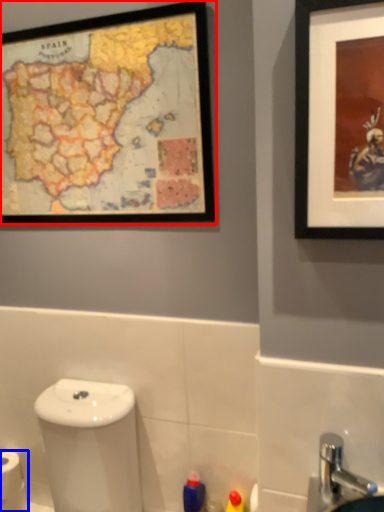
Question: Which object is further to the camera taking this photo, picture frame (highlighted by a red box) or toilet paper (highlighted by a blue box)?

Choices:
 (A) picture frame
 (B) toilet paper

Answer: (B)